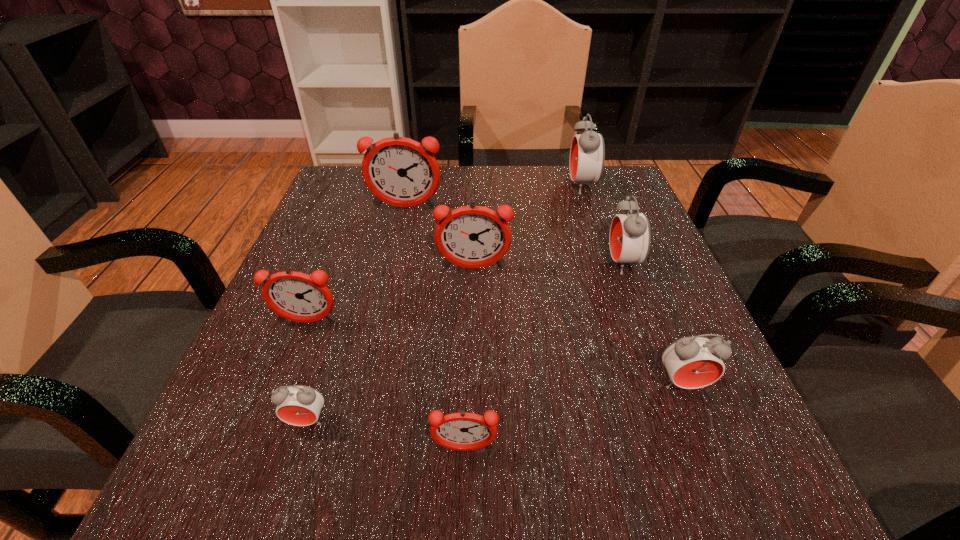
You are a GUI agent. You are given a task and a screenshot of the screen. Output one action in this format:
    pyautogui.click(x=<x>, y=<y>)
    Task: Click on the vacant space at the right edge
    This screenshot has width=960, height=540.
    Given the screenshot: What is the action you would take?
    pyautogui.click(x=583, y=224)

At what (x,y) coordinates should I click in order to perform the action: click on blank area at the far left corner. Please return your answer as a coordinate pair (x, y). Image resolution: width=960 pixels, height=540 pixels. Looking at the image, I should click on (339, 191).

Where is `blank space at the near left corner`? The width and height of the screenshot is (960, 540). blank space at the near left corner is located at coordinates (300, 484).

This screenshot has width=960, height=540. Find the location of `free space at the near right corner`. free space at the near right corner is located at coordinates (720, 454).

Where is `vacant region between the nearest object and the farthest red alarm clock`? vacant region between the nearest object and the farthest red alarm clock is located at coordinates (523, 318).

You are a GUI agent. You are given a task and a screenshot of the screen. Output one action in this format:
    pyautogui.click(x=<x>, y=<y>)
    Task: Click on the free space between the seventh nearest alarm clock and the biggest red alarm clock
    The width and height of the screenshot is (960, 540).
    Given the screenshot: What is the action you would take?
    pyautogui.click(x=493, y=197)

Where is `free spot between the second smallest reddish-pink alarm clock and the biggest reddish-pink alarm clock`? free spot between the second smallest reddish-pink alarm clock and the biggest reddish-pink alarm clock is located at coordinates (356, 265).

Where is `free point between the second farthest reddish-pink alarm clock and the second nearest alarm clock`? free point between the second farthest reddish-pink alarm clock and the second nearest alarm clock is located at coordinates (391, 345).

The height and width of the screenshot is (540, 960). What are the coordinates of `empty space between the seventh farthest object and the third nearest reddish-pink alarm clock` in the screenshot? It's located at (391, 345).

I want to click on vacant area that lies between the fourth nearest alarm clock and the second farthest object, so click(356, 265).